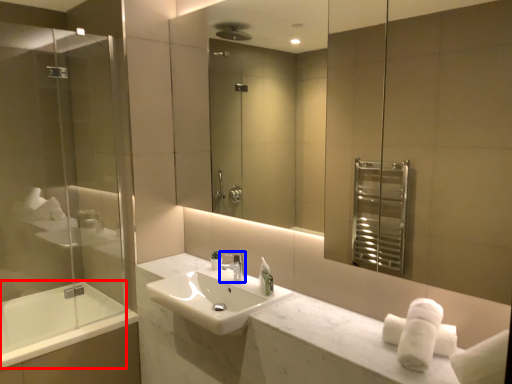
Question: Which of the following is the farthest to the observer, bath (highlighted by a red box) or tap (highlighted by a blue box)?

Choices:
 (A) bath
 (B) tap

Answer: (A)